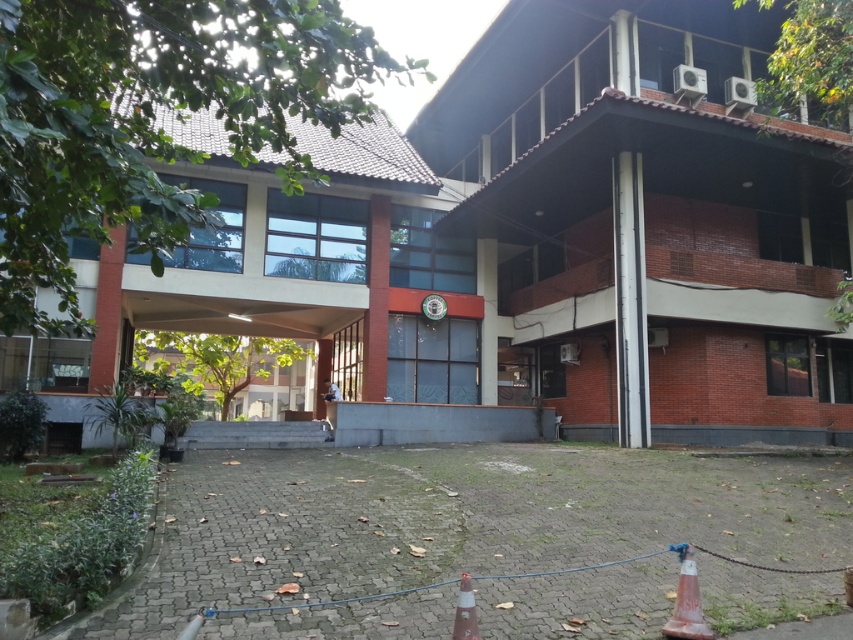
Question: Which point is closer to the camera taking this photo?

Choices:
 (A) (373, 156)
 (B) (695, 595)

Answer: (B)

Question: Does matte brick building at center appear on the left side of orange reflective cone at lower right?

Choices:
 (A) yes
 (B) no

Answer: (A)

Question: Which of the following is the closest to the observer?

Choices:
 (A) orange reflective cone at lower right
 (B) red brick building at center
 (C) orange plastic traffic cone at lower center
 (D) matte brick building at center

Answer: (B)

Question: Is red brick building at center thinner than orange plastic traffic cone at lower center?

Choices:
 (A) no
 (B) yes

Answer: (A)

Question: Which point appears farthest from the camera in this image?

Choices:
 (A) (480, 74)
 (B) (332, 211)

Answer: (A)

Question: Observing the image, what is the correct spatial positioning of red brick building at center in reference to orange plastic traffic cone at lower center?

Choices:
 (A) above
 (B) below

Answer: (A)